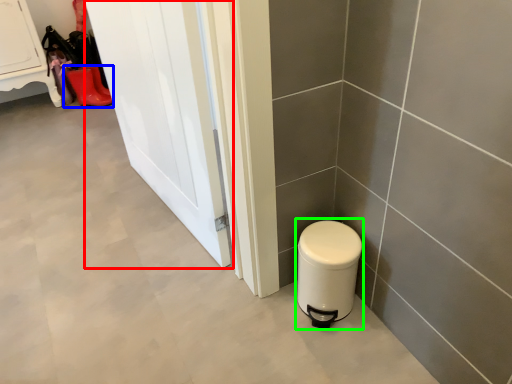
Question: Estimate the real-world distances between objects in this image. Which object is farther from door (highlighted by a red box), footwear (highlighted by a blue box) or water heater (highlighted by a green box)?

Choices:
 (A) footwear
 (B) water heater

Answer: (A)